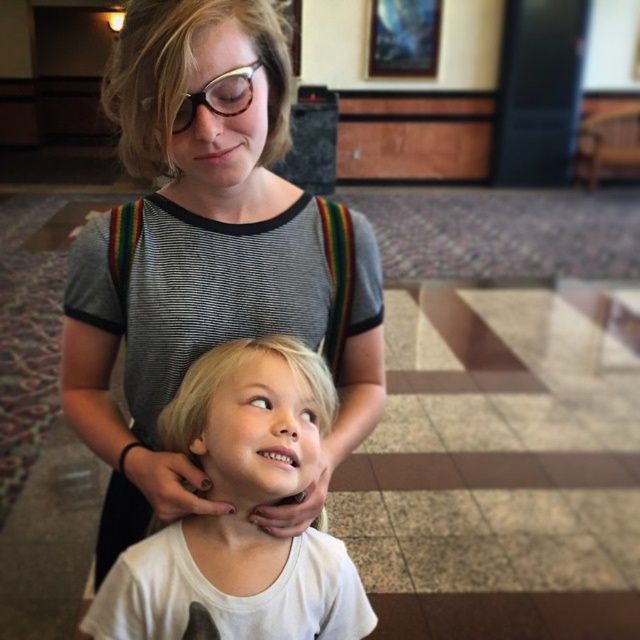
You are a fashion designer observing the scene. You need to determine which item has a greater horizontal span between the white matte shirt at center and the matte black glasses at upper center. Which one is wider?

The white matte shirt at center has a greater width than the matte black glasses at upper center, so the white matte shirt at center is wider.

You are a photographer setting up a shot in this scene. You need to ensure that the white matte shirt at center and the matte black glasses at upper center are both in focus. Given that your camera can only focus on objects within a 15 inch range, will both items be in focus?

The white matte shirt at center is 17.24 inches from matte black glasses at upper center. Since the distance between them exceeds the camera focus range of 15 inches, they cannot both be in focus simultaneously.